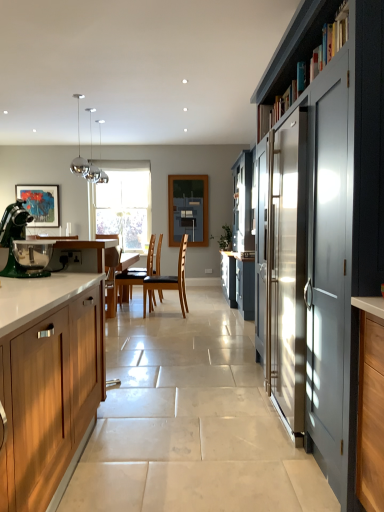
Question: Is matte acrylic painting at left in contact with chrome/metallic pendant lights at upper left?

Choices:
 (A) yes
 (B) no

Answer: (B)

Question: Is matte acrylic painting at left turned away from chrome/metallic pendant lights at upper left?

Choices:
 (A) no
 (B) yes

Answer: (A)

Question: Would you say chrome/metallic pendant lights at upper left is part of matte acrylic painting at left's contents?

Choices:
 (A) no
 (B) yes

Answer: (A)

Question: From the image's perspective, is matte acrylic painting at left on top of chrome/metallic pendant lights at upper left?

Choices:
 (A) no
 (B) yes

Answer: (A)

Question: Is matte acrylic painting at left facing towards chrome/metallic pendant lights at upper left?

Choices:
 (A) no
 (B) yes

Answer: (B)

Question: Choose the correct answer: Is chrome/metallic pendant lights at upper left inside wooden cabinet at left, which is counted as the 2th cabinetry, starting from the right, or outside it?

Choices:
 (A) inside
 (B) outside

Answer: (B)

Question: Is point (107, 181) positioned closer to the camera than point (26, 287)?

Choices:
 (A) farther
 (B) closer

Answer: (A)

Question: Considering the positions of chrome/metallic pendant lights at upper left and wooden cabinet at left, placed as the 1th cabinetry when sorted from left to right, in the image, is chrome/metallic pendant lights at upper left wider or thinner than wooden cabinet at left, placed as the 1th cabinetry when sorted from left to right,?

Choices:
 (A) thin
 (B) wide

Answer: (A)

Question: Is chrome/metallic pendant lights at upper left in front of or behind wooden cabinet at left, which is counted as the 2th cabinetry, starting from the right, in the image?

Choices:
 (A) front
 (B) behind

Answer: (B)

Question: Is matte acrylic painting at left situated inside chrome/metallic pendant lights at upper left or outside?

Choices:
 (A) outside
 (B) inside

Answer: (A)

Question: From the image's perspective, relative to chrome/metallic pendant lights at upper left, is matte acrylic painting at left above or below?

Choices:
 (A) below
 (B) above

Answer: (A)

Question: Is point (26, 208) closer or farther from the camera than point (76, 158)?

Choices:
 (A) closer
 (B) farther

Answer: (A)

Question: From a real-world perspective, is matte acrylic painting at left physically located above or below chrome/metallic pendant lights at upper left?

Choices:
 (A) below
 (B) above

Answer: (A)

Question: Based on their positions, is brown leather chair at center, which is counted as the 2th chair, starting from the left, located to the left or right of green matte stand mixer at left?

Choices:
 (A) left
 (B) right

Answer: (B)

Question: From the image's perspective, is brown leather chair at center, which appears as the 1th chair when viewed from the right, positioned above or below green matte stand mixer at left?

Choices:
 (A) below
 (B) above

Answer: (A)